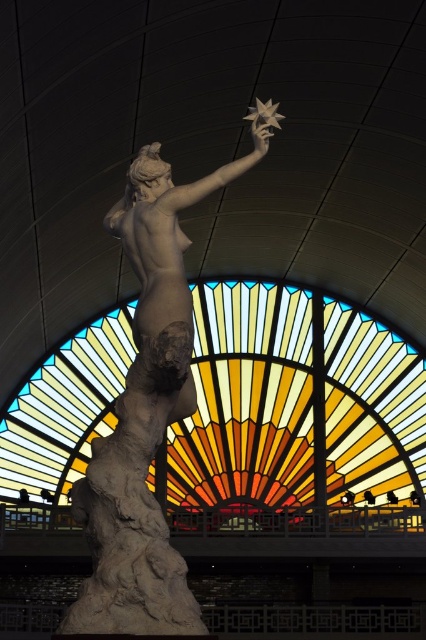
Can you confirm if stained glass at center is wider than matte stone statue at center?

Yes, stained glass at center is wider than matte stone statue at center.

Who is lower down, stained glass at center or matte stone statue at center?

stained glass at center

Is point (400, 426) less distant than point (103, 582)?

That is False.

Image resolution: width=426 pixels, height=640 pixels. What are the coordinates of `stained glass at center` in the screenshot? It's located at (296, 417).

Which is behind, point (161, 280) or point (261, 108)?

The point (261, 108) is more distant.

Locate an element on the screen. matte stone statue at center is located at coordinates (146, 416).

Between point (195, 202) and point (282, 118), which one is positioned behind?

The point (282, 118) is behind.

What are the coordinates of `matte stone statue at center` in the screenshot? It's located at (146, 416).

Which is more to the left, stained glass at center or metallic silver star at upper center?

Positioned to the left is stained glass at center.

Who is higher up, stained glass at center or metallic silver star at upper center?

metallic silver star at upper center is above.

You are a GUI agent. You are given a task and a screenshot of the screen. Output one action in this format:
    pyautogui.click(x=<x>, y=<y>)
    Task: Click on the stained glass at center
    
    Given the screenshot: What is the action you would take?
    pyautogui.click(x=296, y=417)